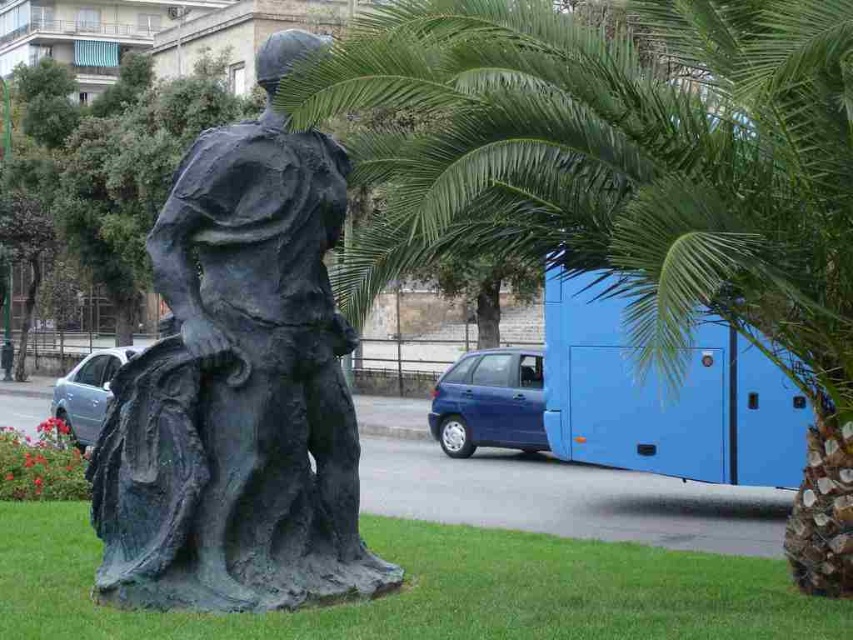
Question: Which of the following is the closest to the observer?

Choices:
 (A) green leafy palm tree at upper right
 (B) bronze statue at center

Answer: (B)

Question: Is green leafy palm tree at upper right positioned before bronze statue at center?

Choices:
 (A) yes
 (B) no

Answer: (B)

Question: Which of the following is the closest to the observer?

Choices:
 (A) bronze statue at center
 (B) green leafy palm tree at upper right

Answer: (A)

Question: Can you confirm if green leafy palm tree at upper right is bigger than bronze statue at center?

Choices:
 (A) yes
 (B) no

Answer: (B)

Question: Does green leafy palm tree at upper right appear on the left side of bronze statue at center?

Choices:
 (A) no
 (B) yes

Answer: (A)